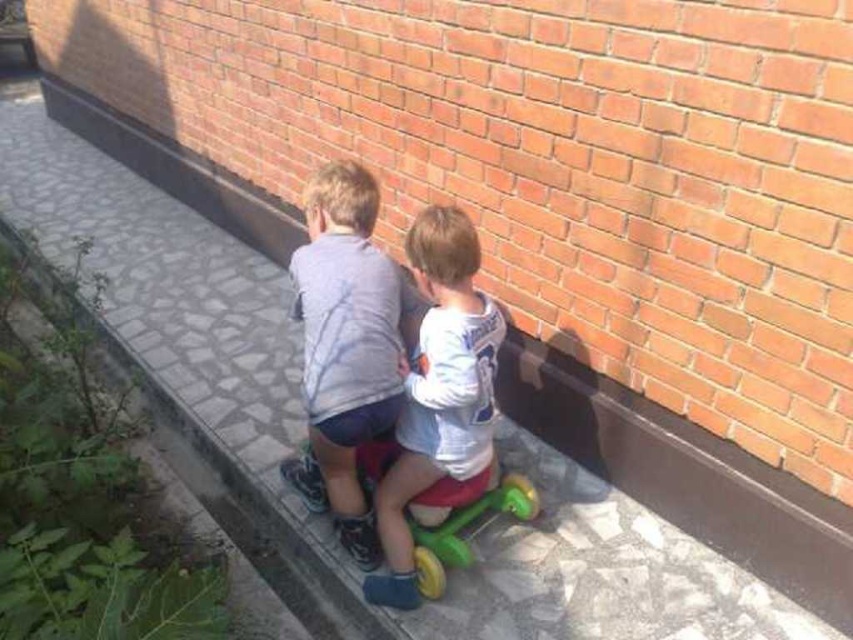
Question: In this image, where is white matte shirt at center located relative to green plastic tricycle at lower center?

Choices:
 (A) right
 (B) left

Answer: (B)

Question: Which of the following is the farthest from the observer?

Choices:
 (A) (497, 500)
 (B) (361, 422)

Answer: (A)

Question: Which point is farther to the camera?

Choices:
 (A) (521, 500)
 (B) (312, 196)
 (C) (451, 300)

Answer: (A)

Question: Does light gray cotton shirt at center have a lesser width compared to green plastic tricycle at lower center?

Choices:
 (A) yes
 (B) no

Answer: (B)

Question: Which object is positioned closest to the green plastic tricycle at lower center?

Choices:
 (A) light gray cotton shirt at center
 (B) white matte shirt at center

Answer: (B)

Question: Is light gray cotton shirt at center to the left of green plastic tricycle at lower center from the viewer's perspective?

Choices:
 (A) no
 (B) yes

Answer: (B)